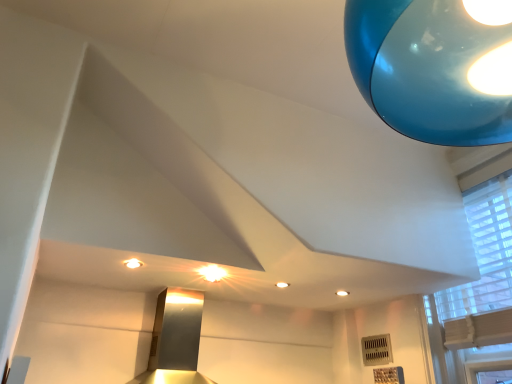
Question: Is point (129, 264) positioned closer to the camera than point (435, 301)?

Choices:
 (A) farther
 (B) closer

Answer: (B)

Question: In the image, is matte white light fixture at upper center on the left side or the right side of white textured window at upper right?

Choices:
 (A) right
 (B) left

Answer: (B)

Question: From the image's perspective, is matte white light fixture at upper center positioned above or below white textured window at upper right?

Choices:
 (A) below
 (B) above

Answer: (B)

Question: Based on their sizes in the image, would you say white textured window at upper right is bigger or smaller than matte white light fixture at upper center?

Choices:
 (A) big
 (B) small

Answer: (A)

Question: In terms of width, does white textured window at upper right look wider or thinner when compared to matte white light fixture at upper center?

Choices:
 (A) thin
 (B) wide

Answer: (B)

Question: From the image's perspective, is white textured window at upper right located above or below matte white light fixture at upper center?

Choices:
 (A) above
 (B) below

Answer: (B)

Question: Visually, is white textured window at upper right positioned to the left or to the right of matte white light fixture at upper center?

Choices:
 (A) left
 (B) right

Answer: (B)